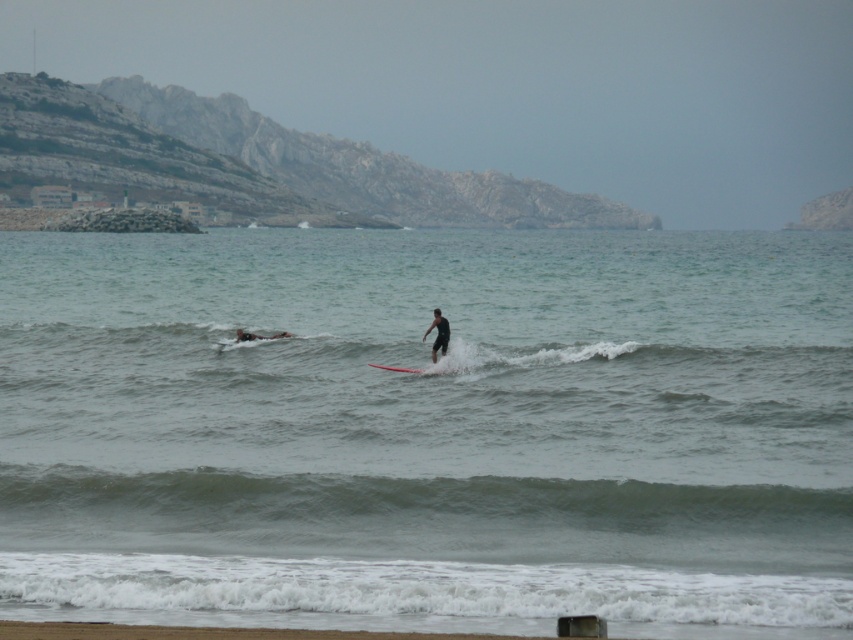
Between smooth sand beach at lower center and smooth red surfboard at center, which one is positioned higher?

smooth red surfboard at center is above.

Can you confirm if smooth sand beach at lower center is bigger than smooth red surfboard at center?

Correct, smooth sand beach at lower center is larger in size than smooth red surfboard at center.

At what (x,y) coordinates should I click in order to perform the action: click on smooth sand beach at lower center. Please return your answer as a coordinate pair (x, y). This screenshot has width=853, height=640. Looking at the image, I should click on (212, 632).

The image size is (853, 640). I want to click on smooth sand beach at lower center, so click(212, 632).

Does clear water at surfboard center have a smaller size compared to black matte surfboard at center?

Actually, clear water at surfboard center might be larger than black matte surfboard at center.

Which is in front, point (215, 348) or point (448, 326)?

Point (448, 326) is in front.

Who is more forward, (427,515) or (440,346)?

Positioned in front is point (427,515).

Identify the location of clear water at surfboard center. The width and height of the screenshot is (853, 640). (428, 429).

Between black matte surfboard at center and smooth black surfboard at center, which one has more height?

black matte surfboard at center

Which of these two, black matte surfboard at center or smooth black surfboard at center, stands shorter?

smooth black surfboard at center is shorter.

Does point (432, 324) come closer to viewer compared to point (252, 332)?

Yes.

Where is `black matte surfboard at center`? This screenshot has width=853, height=640. black matte surfboard at center is located at coordinates point(438,333).